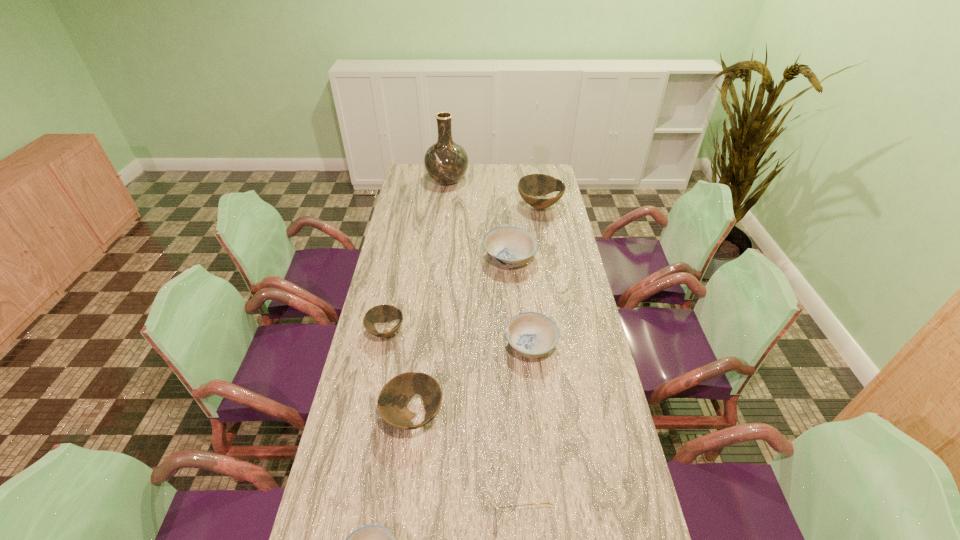
At what (x,y) coordinates should I click in order to perform the action: click on vacant space positioned 0.330m on the right of the vase. Please return your answer as a coordinate pair (x, y). Looking at the image, I should click on (532, 181).

Where is `free spot located 0.130m on the front of the second tallest object`? This screenshot has width=960, height=540. free spot located 0.130m on the front of the second tallest object is located at coordinates (545, 237).

Identify the location of free location located 0.290m on the back of the nearest brown bowl. (424, 320).

Where is `vacant space situated 0.080m on the left of the farthest blue bowl`? vacant space situated 0.080m on the left of the farthest blue bowl is located at coordinates (463, 259).

This screenshot has width=960, height=540. I want to click on vacant space located 0.110m on the front of the second farthest blue bowl, so click(x=537, y=398).

This screenshot has width=960, height=540. What are the coordinates of `vacant space situated 0.250m on the right of the smallest brown bowl` in the screenshot? It's located at (477, 332).

Where is `object that is at the far edge`? The image size is (960, 540). object that is at the far edge is located at coordinates (446, 162).

Locate an element on the screen. vase positioned at the left edge is located at coordinates (446, 162).

At what (x,y) coordinates should I click in order to perform the action: click on object located in the far left corner section of the desktop. Please return your answer as a coordinate pair (x, y). Looking at the image, I should click on (446, 162).

Locate an element on the screen. This screenshot has width=960, height=540. free spot at the far edge of the desktop is located at coordinates (512, 177).